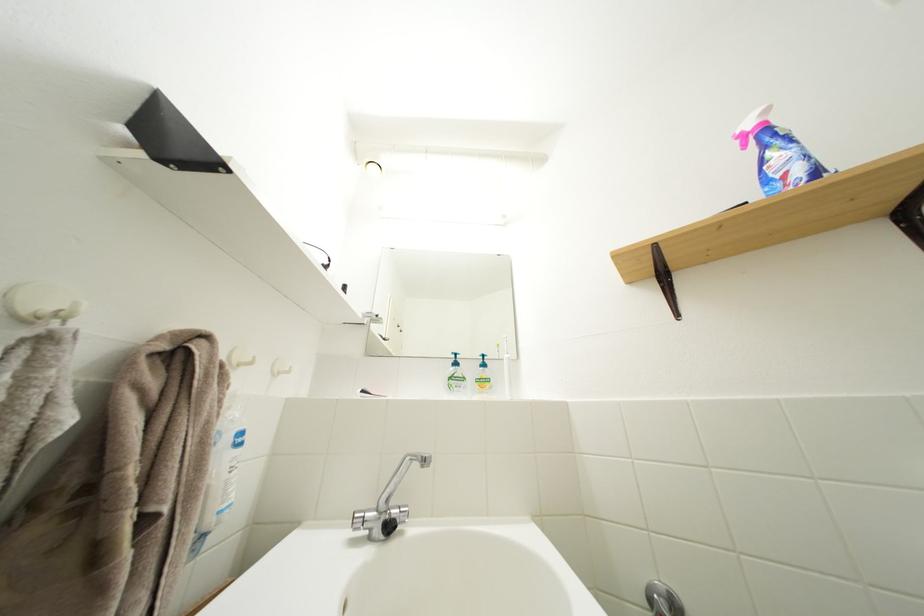
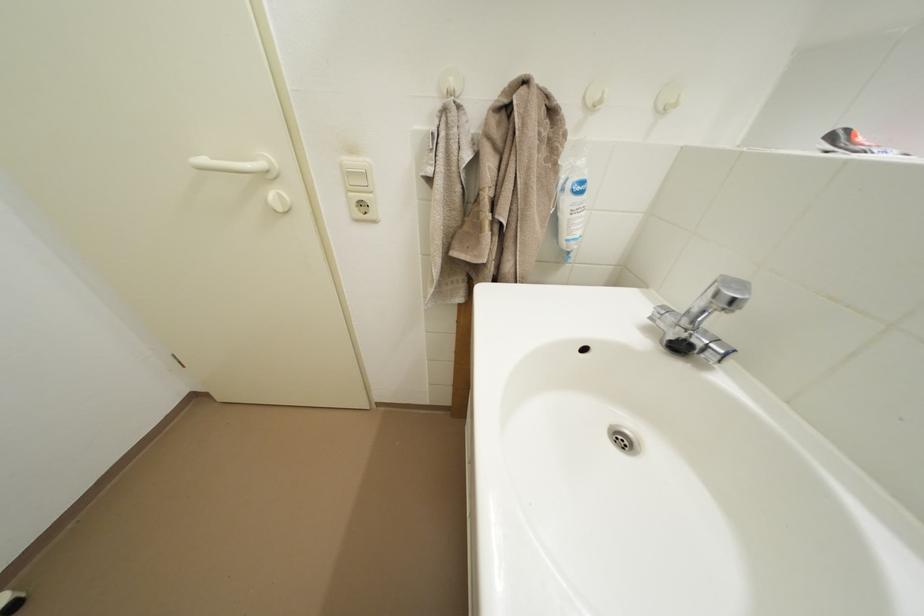
How did the camera likely rotate?

The camera rotated toward left-down.